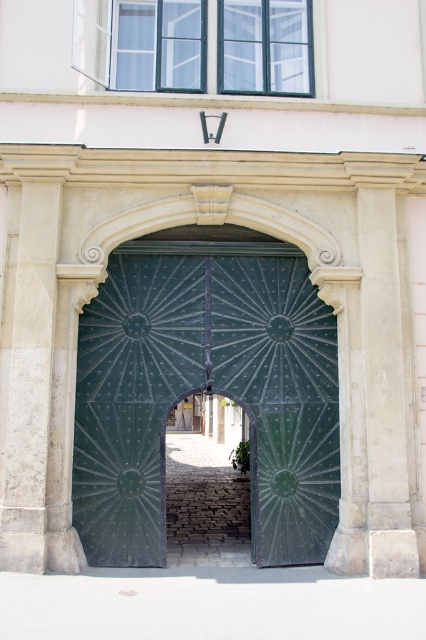
Question: Which of the following is the farthest from the observer?

Choices:
 (A) green textured gate at center
 (B) white stone column at right
 (C) green textured metal door at center
 (D) white stone pillar at left

Answer: (A)

Question: Among these points, which one is nearest to the camera?

Choices:
 (A) (28, 188)
 (B) (227, 264)
 (C) (187, 550)

Answer: (A)

Question: Does green textured metal door at center appear under white stone column at right?

Choices:
 (A) no
 (B) yes

Answer: (B)

Question: Is white stone pillar at left positioned at the back of white stone column at right?

Choices:
 (A) yes
 (B) no

Answer: (B)

Question: Which object is closer to the camera taking this photo?

Choices:
 (A) green textured gate at center
 (B) green textured metal door at center
 (C) white stone pillar at left

Answer: (C)

Question: Does green textured metal door at center lie in front of white stone pillar at left?

Choices:
 (A) yes
 (B) no

Answer: (B)